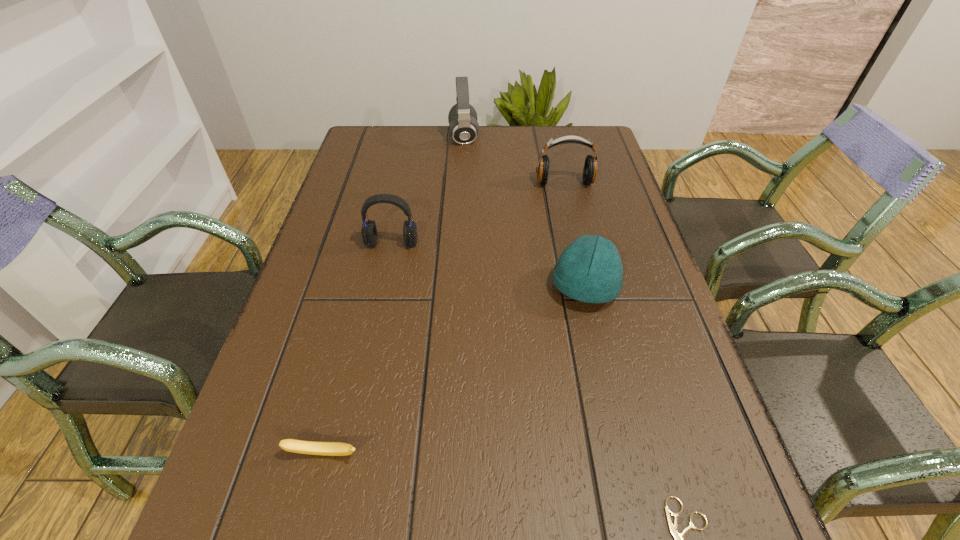
Locate an element on the screen. the second closest object to the second shortest object is located at coordinates (590, 270).

This screenshot has height=540, width=960. Find the location of `object that ranks as the fifth closest to the rightmost headset`. object that ranks as the fifth closest to the rightmost headset is located at coordinates (291, 445).

Identify which headset is located as the third nearest to the second nearest object. Please provide its 2D coordinates. Your answer should be formatted as a tuple, i.e. [(x, y)], where the tuple contains the x and y coordinates of a point satisfying the conditions above.

[(463, 127)]

Where is `headset that is the second closest to the farthest headset`? headset that is the second closest to the farthest headset is located at coordinates point(369,233).

Image resolution: width=960 pixels, height=540 pixels. In order to click on free space that satisfies the following two spatial constraints: 1. on the headband of the third shortest object; 2. on the left side of the nearest headset in this screenshot , I will do `click(382, 287)`.

This screenshot has height=540, width=960. In order to click on blank area in the image that satisfies the following two spatial constraints: 1. on the headband of the beanie; 2. on the right side of the leftmost headset in this screenshot , I will do pos(382,287).

Identify the location of free location that satisfies the following two spatial constraints: 1. on the ear cups of the farthest headset; 2. on the headband of the nearest headset. (459, 243).

I want to click on vacant space that satisfies the following two spatial constraints: 1. on the ear cups of the fourth farthest object; 2. on the right side of the farthest object, so click(456, 287).

The width and height of the screenshot is (960, 540). In order to click on vacant space that satisfies the following two spatial constraints: 1. on the ear cups of the second headset from left to right; 2. at the stem of the second shortest object in this screenshot , I will do `click(447, 454)`.

Identify the location of free space that satisfies the following two spatial constraints: 1. on the ear cups of the tallest headset; 2. on the headband of the third farthest object. This screenshot has width=960, height=540. (459, 243).